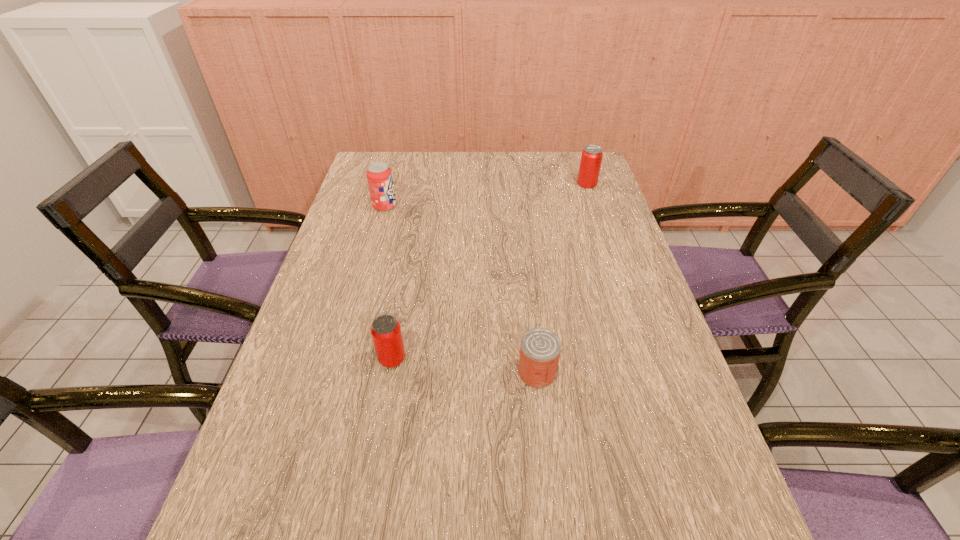
At what (x,y) coordinates should I click in order to perform the action: click on soda can. Please return your answer as a coordinate pair (x, y). Looking at the image, I should click on point(379,176).

Find the location of a particular element. This screenshot has height=540, width=960. the second farthest object is located at coordinates (379, 176).

Image resolution: width=960 pixels, height=540 pixels. What are the coordinates of `the rightmost object` in the screenshot? It's located at (591, 158).

Locate an element on the screen. The width and height of the screenshot is (960, 540). the farthest can is located at coordinates (591, 158).

Where is `the second object from left to right`? The height and width of the screenshot is (540, 960). the second object from left to right is located at coordinates (386, 333).

Locate an element on the screen. the third object from left to right is located at coordinates (540, 348).

Where is `the shortest can`? Image resolution: width=960 pixels, height=540 pixels. the shortest can is located at coordinates (540, 348).

This screenshot has width=960, height=540. I want to click on vacant space situated 0.330m on the surface of the leftmost object, so click(497, 206).

Where is `vacant space situated on the left of the rightmost object`? The width and height of the screenshot is (960, 540). vacant space situated on the left of the rightmost object is located at coordinates (551, 184).

Identify the location of vacant area situated 0.230m on the front of the leftmost can. Image resolution: width=960 pixels, height=540 pixels. (372, 476).